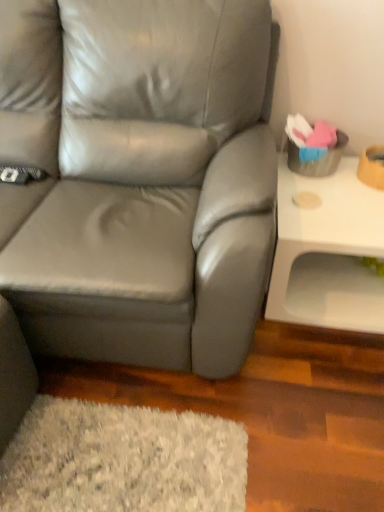
Locate an element on the screen. The height and width of the screenshot is (512, 384). vacant point above white glossy table at right (from a real-world perspective) is located at coordinates (340, 196).